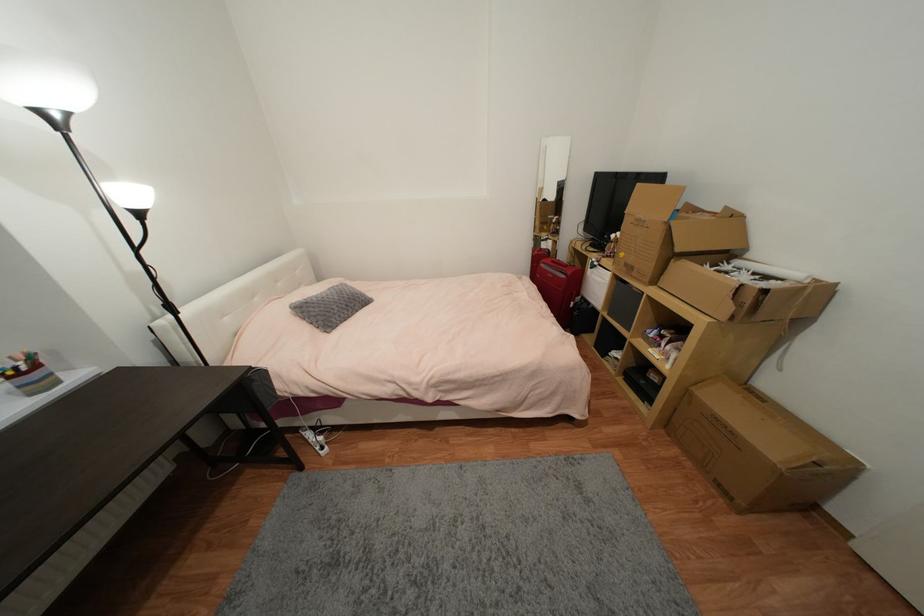
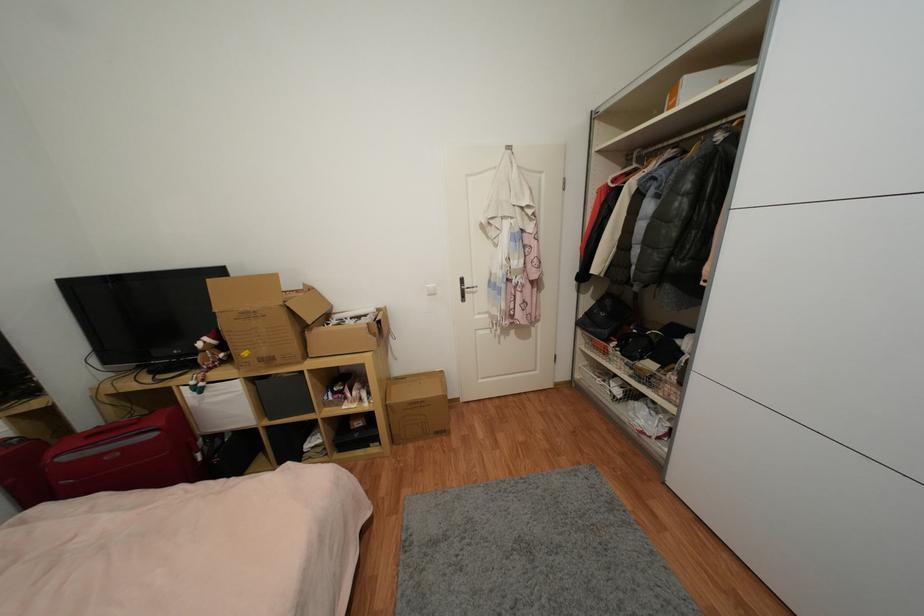
The point at (600, 265) is marked in the first image. Where is the corresponding point in the second image?

(205, 386)